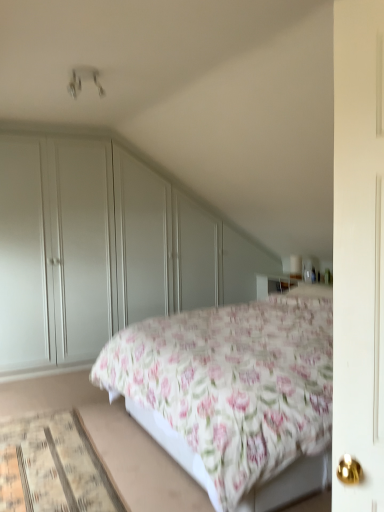
What do you see at coordinates (102, 251) in the screenshot? The width and height of the screenshot is (384, 512). I see `matte white wardrobe at left` at bounding box center [102, 251].

Describe the element at coordinates (54, 467) in the screenshot. I see `beige woven mat at lower left` at that location.

The width and height of the screenshot is (384, 512). What do you see at coordinates (236, 394) in the screenshot? I see `floral cotton bed at center` at bounding box center [236, 394].

Find the location of a particular element. The height and width of the screenshot is (512, 384). matte white wardrobe at left is located at coordinates click(x=102, y=251).

Can you tell me how much matte white wardrobe at left and floral cotton bed at center differ in facing direction?

matte white wardrobe at left and floral cotton bed at center are facing 83.9 degrees away from each other.

Is matte white wardrobe at left far from floral cotton bed at center?

Indeed, matte white wardrobe at left is not near floral cotton bed at center.

Considering the sizes of objects matte white wardrobe at left and floral cotton bed at center in the image provided, who is smaller, matte white wardrobe at left or floral cotton bed at center?

With smaller size is matte white wardrobe at left.

Could you tell me if matte white wardrobe at left is facing floral cotton bed at center?

Yes.

Between beige woven mat at lower left and floral cotton bed at center, which one appears on the right side from the viewer's perspective?

From the viewer's perspective, floral cotton bed at center appears more on the right side.

Based on their sizes in the image, would you say beige woven mat at lower left is bigger or smaller than floral cotton bed at center?

In the image, beige woven mat at lower left appears to be smaller than floral cotton bed at center.

Can you tell me how much beige woven mat at lower left and floral cotton bed at center differ in facing direction?

The angle between the facing direction of beige woven mat at lower left and the facing direction of floral cotton bed at center is 86.9 degrees.

Does beige woven mat at lower left have a lesser width compared to matte white wardrobe at left?

No, beige woven mat at lower left is not thinner than matte white wardrobe at left.

Can you confirm if beige woven mat at lower left is smaller than matte white wardrobe at left?

Yes.

Can you confirm if beige woven mat at lower left is positioned to the right of matte white wardrobe at left?

Incorrect, beige woven mat at lower left is not on the right side of matte white wardrobe at left.

Between point (12, 493) and point (22, 253), which one is positioned behind?

The point (22, 253) is farther from the camera.

From a real-world perspective, is floral cotton bed at center physically above beige woven mat at lower left?

Indeed, from a real-world perspective, floral cotton bed at center stands above beige woven mat at lower left.

Would you say floral cotton bed at center is to the left or to the right of beige woven mat at lower left in the picture?

From the image, it's evident that floral cotton bed at center is to the right of beige woven mat at lower left.

Can you confirm if floral cotton bed at center is smaller than beige woven mat at lower left?

Incorrect, floral cotton bed at center is not smaller in size than beige woven mat at lower left.

Based on their sizes in the image, would you say matte white wardrobe at left is bigger or smaller than beige woven mat at lower left?

Clearly, matte white wardrobe at left is larger in size than beige woven mat at lower left.

Is matte white wardrobe at left located outside beige woven mat at lower left?

matte white wardrobe at left lies outside beige woven mat at lower left's area.

Which is less distant, (79, 244) or (15, 466)?

Point (79, 244) is farther from the camera than point (15, 466).

From a real-world perspective, is floral cotton bed at center above or below matte white wardrobe at left?

From a real-world perspective, floral cotton bed at center is physically below matte white wardrobe at left.

Is point (291, 298) in front of point (120, 317)?

Yes, it is in front of point (120, 317).

Is floral cotton bed at center aimed at matte white wardrobe at left?

No, floral cotton bed at center is not aimed at matte white wardrobe at left.

Would you say matte white wardrobe at left is part of floral cotton bed at center's contents?

No, matte white wardrobe at left is not a part of floral cotton bed at center.

The image size is (384, 512). I want to click on dresser that is on the left side of floral cotton bed at center, so click(102, 251).

The image size is (384, 512). There is a beige woven mat at lower left. Find the location of `bed above it (from a real-world perspective)`. bed above it (from a real-world perspective) is located at coordinates tap(236, 394).

Based on their spatial positions, is floral cotton bed at center or beige woven mat at lower left closer to matte white wardrobe at left?

Among the two, floral cotton bed at center is located nearer to matte white wardrobe at left.

Based on their spatial positions, is beige woven mat at lower left or floral cotton bed at center further from matte white wardrobe at left?

beige woven mat at lower left is further to matte white wardrobe at left.

Considering their positions, is floral cotton bed at center positioned further to beige woven mat at lower left than matte white wardrobe at left?

Among the two, matte white wardrobe at left is located further to beige woven mat at lower left.

From the image, which object appears to be nearer to floral cotton bed at center, beige woven mat at lower left or matte white wardrobe at left?

beige woven mat at lower left lies closer to floral cotton bed at center than the other object.

Looking at this image, looking at the image, which one is located further to beige woven mat at lower left, matte white wardrobe at left or floral cotton bed at center?

matte white wardrobe at left lies further to beige woven mat at lower left than the other object.

When comparing their distances from floral cotton bed at center, does matte white wardrobe at left or beige woven mat at lower left seem closer?

The object closer to floral cotton bed at center is beige woven mat at lower left.

Where is `mat between floral cotton bed at center and matte white wardrobe at left from front to back`? mat between floral cotton bed at center and matte white wardrobe at left from front to back is located at coordinates (54, 467).